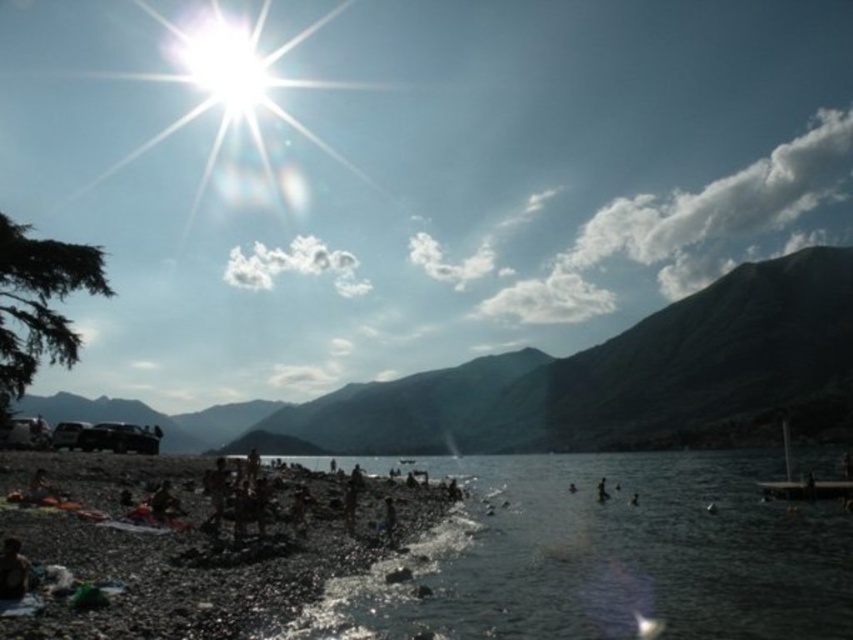
You are standing at the lakeside and want to take a photo of the dark brown pebbles at lower left and the green matte mountain at upper center. Which object should you focus on first if you want both to be in sharp focus?

You should focus on the green matte mountain at upper center first because it is farther away from you than the dark brown pebbles at lower left. By focusing on the distant object, the closer object will also be in focus due to the depth of field.